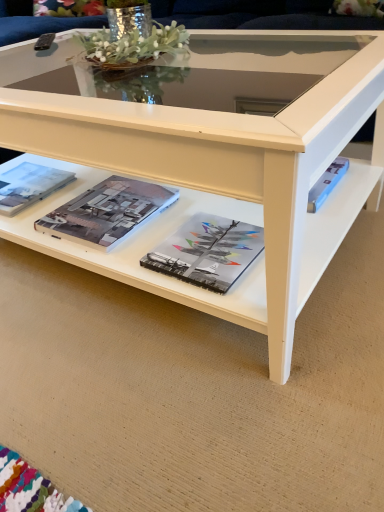
Question: From their relative heights in the image, would you say matte hardcover book at center, positioned as the 3th magazine in left-to-right order, is taller or shorter than white glossy coffee table at center?

Choices:
 (A) tall
 (B) short

Answer: (B)

Question: Is matte hardcover book at center, positioned as the 3th magazine in left-to-right order, situated inside white glossy coffee table at center or outside?

Choices:
 (A) outside
 (B) inside

Answer: (A)

Question: Which object is positioned farthest from the matte hardcover book at center, the first magazine in the right-to-left sequence?

Choices:
 (A) white glossy coffee table at center
 (B) matte paper magazine at left, the first magazine positioned from the left
 (C) matte paper magazine at center, the second magazine from the left

Answer: (B)

Question: Based on their relative distances, which object is nearer to the matte paper magazine at left, the first magazine positioned from the left?

Choices:
 (A) matte paper magazine at center, the second magazine from the left
 (B) white glossy coffee table at center
 (C) matte hardcover book at center, the first magazine in the right-to-left sequence

Answer: (A)